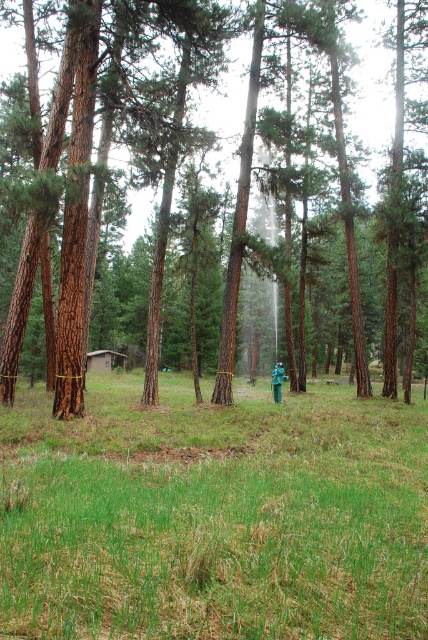
You are navigating through a dense forest and come across a clearing with tall pine trees. You notice a bright green outfit in the center. There is a specific point marked at coordinates (214,513). What is located at that point?

The point at (214,513) indicates green grass at center.

You are a hiker in the forest and want to sit down on the green grass at center. However, you need to make sure that the brown rough tree at center won not block your view. Can you sit there without the tree blocking your view?

The green grass at center has a smaller size compared to brown rough tree at center, so the tree is taller. Therefore, sitting on the green grass at center may still allow you to see over the tree if you are tall enough, but the tree could partially block your view depending on its height relative to your eye level.

Consider the image. You are a hiker in the forest clearing. You need to cross the area between the green grass at center and the brown rough tree at center. Which direction should you walk to avoid the tree?

The brown rough tree at center is taller than the green grass at center. To avoid the tree, walk around it towards the direction where the green grass at center is located since the tree is taller and occupies more space above the ground.